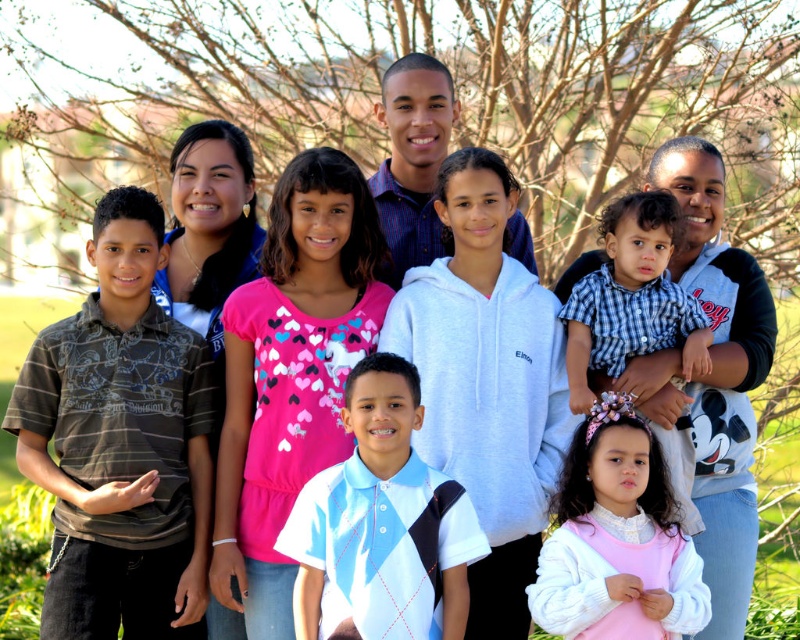
Question: Which is farther from the brown striped polo shirt at left?

Choices:
 (A) white fleece hoodie at upper right
 (B) checkered fabric shirt at center
 (C) light blue argyle polo shirt at center
 (D) pink velvet dress at lower right

Answer: (A)

Question: Among these points, which one is nearest to the camera?

Choices:
 (A) (454, 605)
 (B) (574, 358)
 (C) (666, 568)
 (D) (704, 150)

Answer: (C)

Question: Does brown striped polo shirt at left have a larger size compared to light blue argyle polo shirt at center?

Choices:
 (A) no
 (B) yes

Answer: (B)

Question: Among these points, which one is nearest to the camera?

Choices:
 (A) (188, 525)
 (B) (604, 237)
 (C) (648, 561)
 (D) (709, 156)

Answer: (C)

Question: Is light blue argyle polo shirt at center to the right of white fleece hoodie at upper right from the viewer's perspective?

Choices:
 (A) no
 (B) yes

Answer: (A)

Question: Can you confirm if white fleece hoodie at upper right is wider than pink velvet dress at lower right?

Choices:
 (A) yes
 (B) no

Answer: (B)